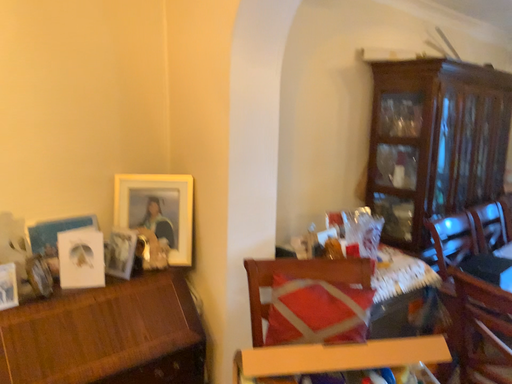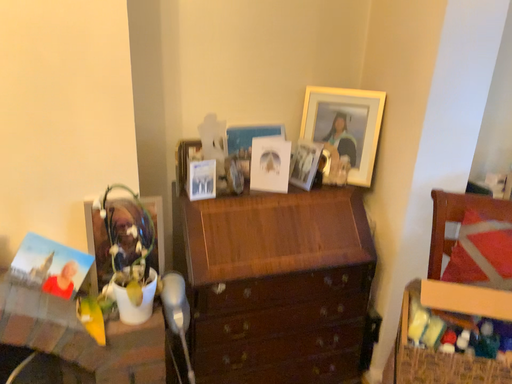
Question: How did the camera likely rotate when shooting the video?

Choices:
 (A) rotated right
 (B) rotated left

Answer: (B)